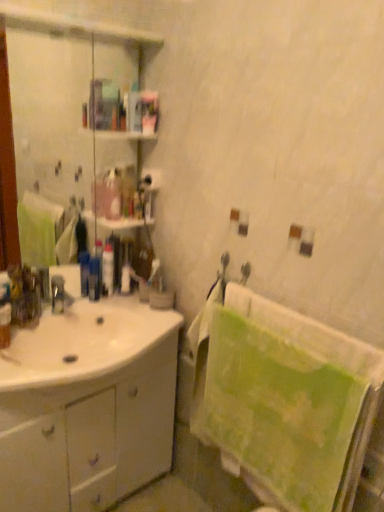
What are the coordinates of `vacant region in front of blue plastic toothbrush at center, which ranks as the 3th toiletry in right-to-left order` in the screenshot? It's located at (80, 307).